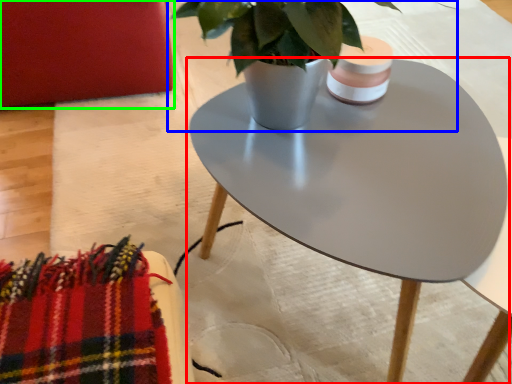
Question: Which object is the closest to the coffee table (highlighted by a red box)? Choose among these: houseplant (highlighted by a blue box) or armchair (highlighted by a green box).

Choices:
 (A) houseplant
 (B) armchair

Answer: (A)